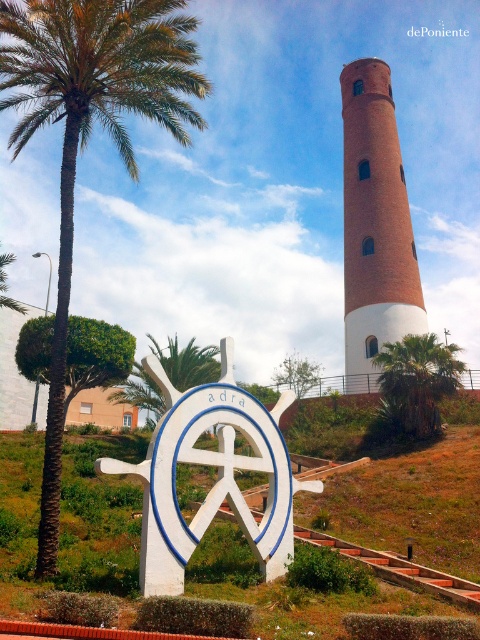
You are a tourist visiting Adra and want to take a photo of both the white matte sign at center and the brick tower at center. Which object should you position closer to the camera to ensure both are fully visible in the frame?

The white matte sign at center is thinner than the brick tower at center, so you should position the brick tower at center closer to the camera to accommodate its larger width within the frame.